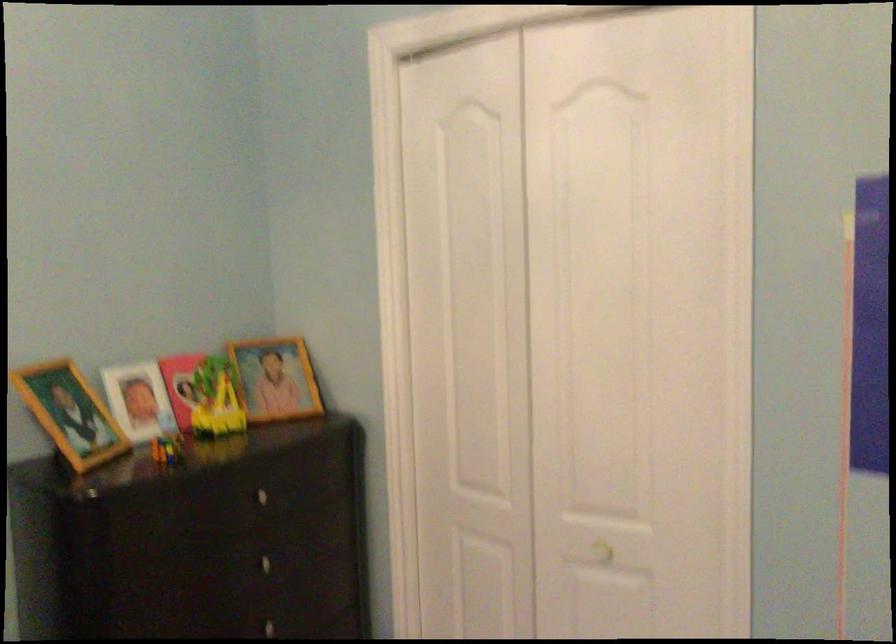
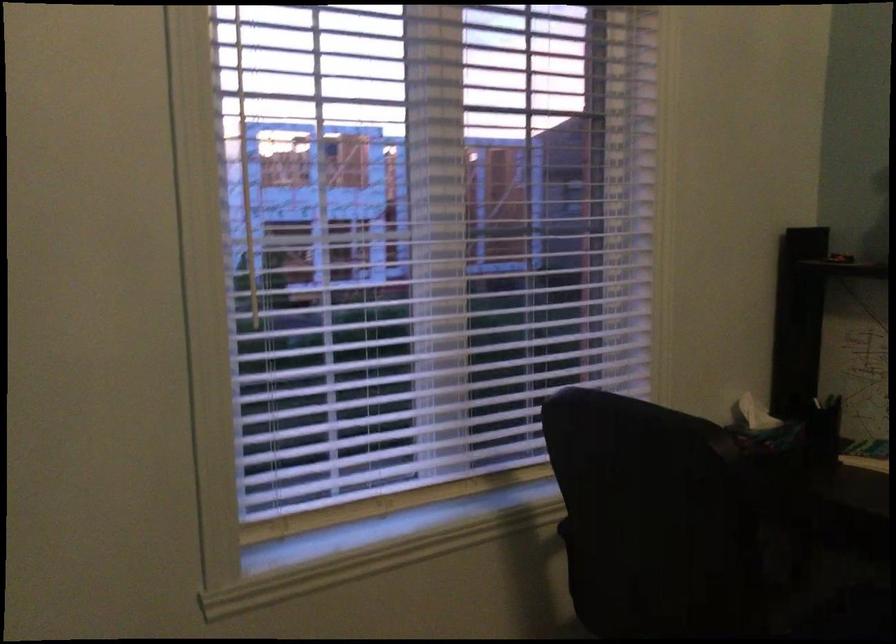
Question: The camera is either moving clockwise (left) or counter-clockwise (right) around the object. The first image is from the beginning of the video and the second image is from the end. Is the camera moving left or right when shooting the video?

Choices:
 (A) Left
 (B) Right

Answer: (B)